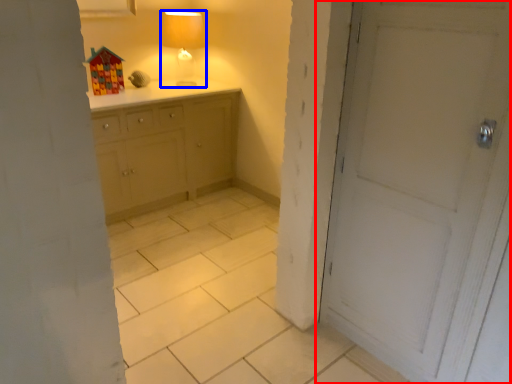
Question: Which object appears closest to the camera in this image, door (highlighted by a red box) or table lamp (highlighted by a blue box)?

Choices:
 (A) door
 (B) table lamp

Answer: (A)